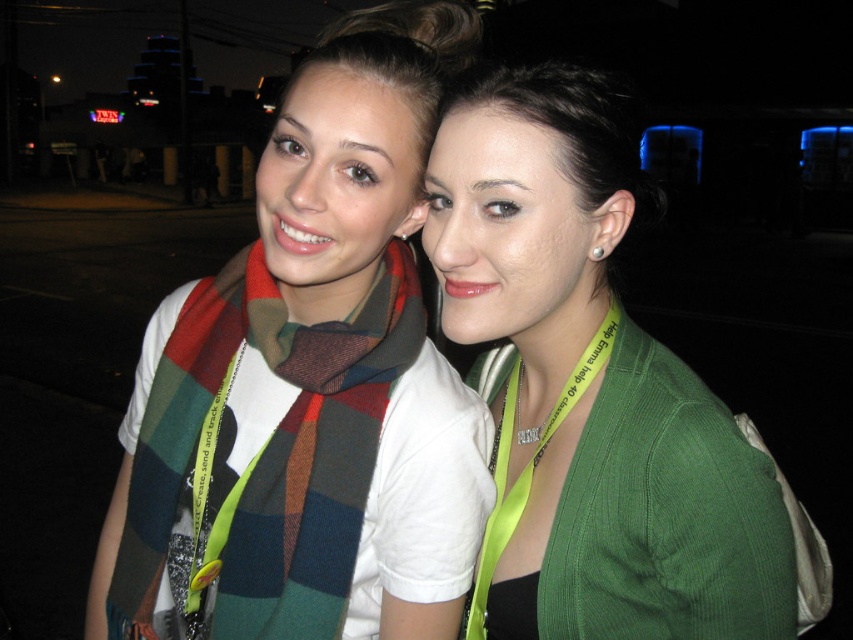
You are a photographer trying to adjust the lighting for a portrait. You notice the green corduroy cardigan at center and the plaid wool scarf at left. Which object should you focus on if you want to highlight something higher in the frame?

The green corduroy cardigan at center is above the plaid wool scarf at left, so focusing on the green corduroy cardigan at center would highlight something higher in the frame.

You are standing in front of the two people in the image. You want to place a small gift exactly at the point labeled as point (746, 449). If your arm reaches 75 centimeters, can you reach that point?

The point (746, 449) is 74.97 centimeters away from the viewer. Since your arm reaches 75 centimeters, you can just barely reach it.

You are a fashion designer observing the two items in the image. Which item is taller between the green corduroy cardigan at center and the plaid wool scarf at left?

The green corduroy cardigan at center is much taller than the plaid wool scarf at left.